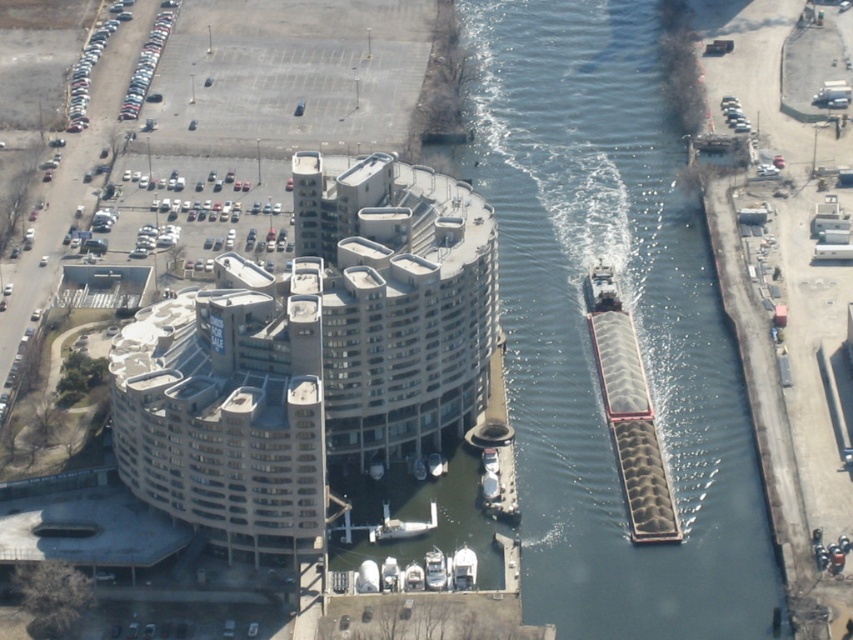
Based on the photo, you are a delivery drone planning to land on the smooth concrete waterway at center. The gray metallic barge at right is currently moving through the waterway. Based on their sizes, do you think there is enough space for the drone to land safely?

The smooth concrete waterway at center might be wider than gray metallic barge at right, so there could be enough space for the drone to land safely if the barge is not occupying the entire width of the waterway.